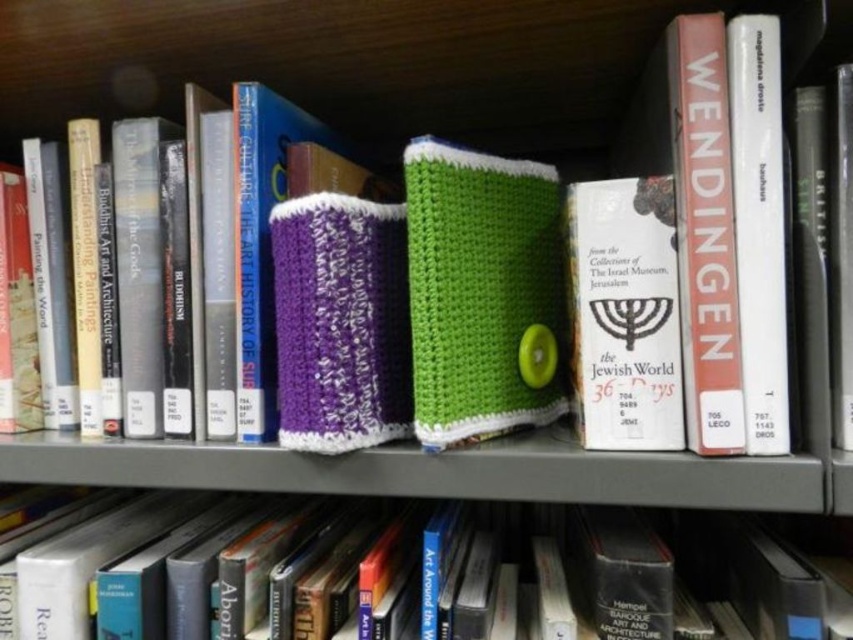
Does hardcover book at center appear on the left side of white paper book at center?

Indeed, hardcover book at center is positioned on the left side of white paper book at center.

Can you confirm if hardcover book at center is positioned above white paper book at center?

Actually, hardcover book at center is below white paper book at center.

This screenshot has width=853, height=640. I want to click on hardcover book at center, so click(x=399, y=570).

Between point (572, 573) and point (512, 422), which one is positioned in front?

Positioned in front is point (512, 422).

Based on the photo, who is positioned more to the left, hardcover book at center or green knitted book at center?

From the viewer's perspective, hardcover book at center appears more on the left side.

Looking at this image, who is more forward, (805, 566) or (459, 328)?

Positioned in front is point (459, 328).

Locate an element on the screen. The height and width of the screenshot is (640, 853). hardcover book at center is located at coordinates (399, 570).

Consider the image. Does green knitted book at center have a lesser height compared to white paper book at upper right?

Correct, green knitted book at center is not as tall as white paper book at upper right.

Who is lower down, green knitted book at center or white paper book at upper right?

Positioned lower is green knitted book at center.

Does point (548, 378) come behind point (763, 451)?

Yes, point (548, 378) is behind point (763, 451).

Where is `green knitted book at center`? This screenshot has height=640, width=853. green knitted book at center is located at coordinates (482, 291).